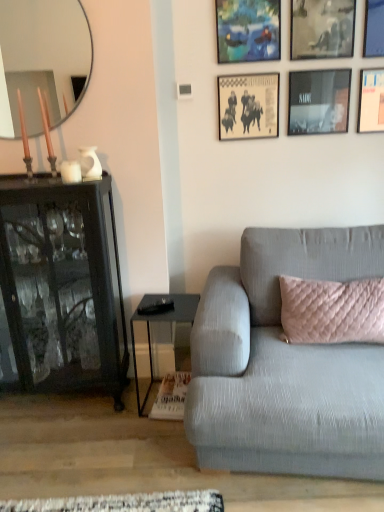
Question: Does beige paper picture frame at upper center, the second picture frame from the left, have a larger size compared to blue textured fabric picture frame at upper center, positioned as the 6th picture frame in right-to-left order?

Choices:
 (A) yes
 (B) no

Answer: (B)

Question: Can you confirm if beige paper picture frame at upper center, which ranks as the 5th picture frame in right-to-left order, is shorter than blue textured fabric picture frame at upper center, the 1th picture frame in the left-to-right sequence?

Choices:
 (A) no
 (B) yes

Answer: (A)

Question: Is beige paper picture frame at upper center, the second picture frame from the left, behind blue textured fabric picture frame at upper center, positioned as the 6th picture frame in right-to-left order?

Choices:
 (A) no
 (B) yes

Answer: (B)

Question: Is beige paper picture frame at upper center, which ranks as the 5th picture frame in right-to-left order, positioned with its back to blue textured fabric picture frame at upper center, positioned as the 6th picture frame in right-to-left order?

Choices:
 (A) no
 (B) yes

Answer: (A)

Question: Is beige paper picture frame at upper center, which ranks as the 5th picture frame in right-to-left order, to the left of blue textured fabric picture frame at upper center, positioned as the 6th picture frame in right-to-left order, from the viewer's perspective?

Choices:
 (A) no
 (B) yes

Answer: (A)

Question: From the image's perspective, is textured gray couch at right above or below black glossy picture frame at upper right, which appears as the third picture frame when viewed from the right?

Choices:
 (A) below
 (B) above

Answer: (A)

Question: Considering their positions, is textured gray couch at right located in front of or behind black glossy picture frame at upper right, the 4th picture frame from the left?

Choices:
 (A) behind
 (B) front

Answer: (B)

Question: Would you say textured gray couch at right is inside or outside black glossy picture frame at upper right, which appears as the third picture frame when viewed from the right?

Choices:
 (A) inside
 (B) outside

Answer: (B)

Question: From a real-world perspective, relative to black glossy picture frame at upper right, which appears as the third picture frame when viewed from the right, is textured gray couch at right vertically above or below?

Choices:
 (A) above
 (B) below

Answer: (B)

Question: Visually, is matte glass mirror at upper left positioned to the left or to the right of black glossy picture frame at upper right, the 4th picture frame from the left?

Choices:
 (A) left
 (B) right

Answer: (A)

Question: Which is correct: matte glass mirror at upper left is inside black glossy picture frame at upper right, which appears as the third picture frame when viewed from the right, or outside of it?

Choices:
 (A) inside
 (B) outside

Answer: (B)

Question: From a real-world perspective, is matte glass mirror at upper left positioned above or below black glossy picture frame at upper right, which appears as the third picture frame when viewed from the right?

Choices:
 (A) below
 (B) above

Answer: (B)

Question: From the image's perspective, relative to black glossy picture frame at upper right, which appears as the third picture frame when viewed from the right, is matte glass mirror at upper left above or below?

Choices:
 (A) below
 (B) above

Answer: (B)

Question: Is metallic silver picture frame at upper right, the 1th picture frame in the right-to-left sequence, inside or outside of textured gray couch at right?

Choices:
 (A) inside
 (B) outside

Answer: (B)

Question: Based on their positions, is metallic silver picture frame at upper right, the 1th picture frame in the right-to-left sequence, located to the left or right of textured gray couch at right?

Choices:
 (A) left
 (B) right

Answer: (B)